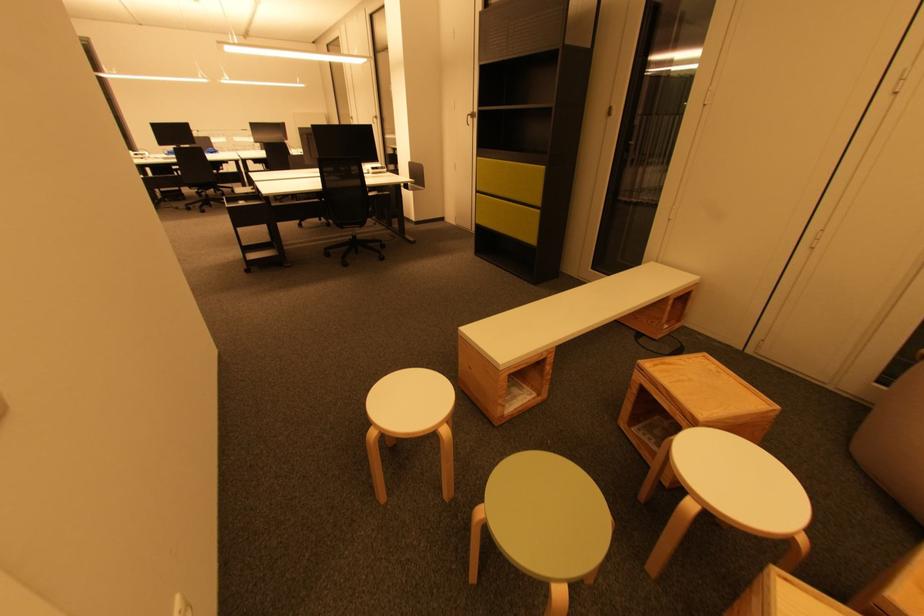
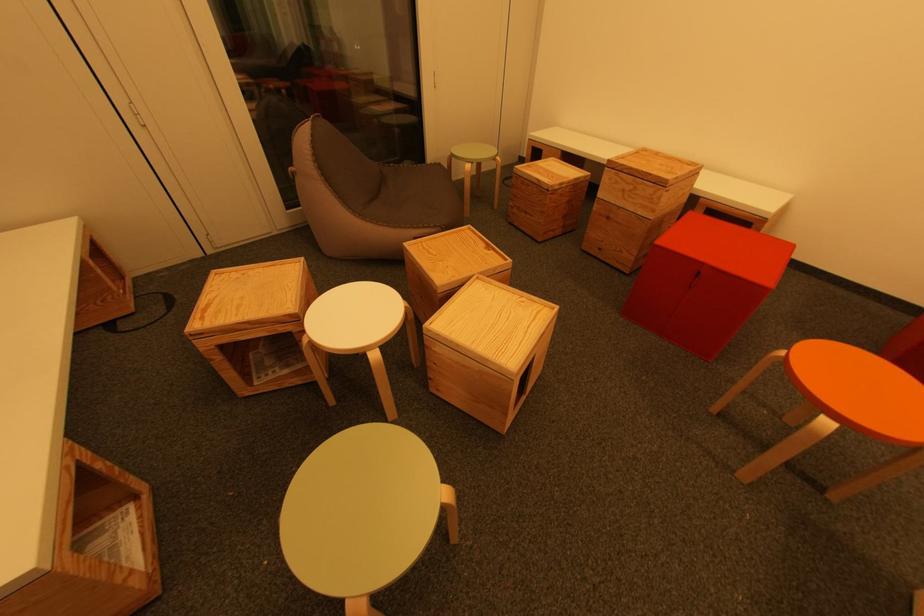
Consider the image. How did the camera likely rotate?

The rotation direction of the camera is right-down.